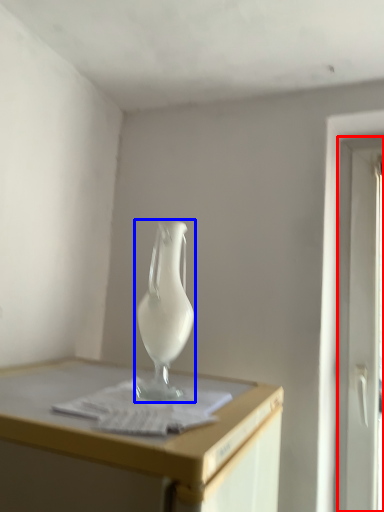
Question: Among these objects, which one is nearest to the camera, screen door (highlighted by a red box) or vase (highlighted by a blue box)?

Choices:
 (A) screen door
 (B) vase

Answer: (B)